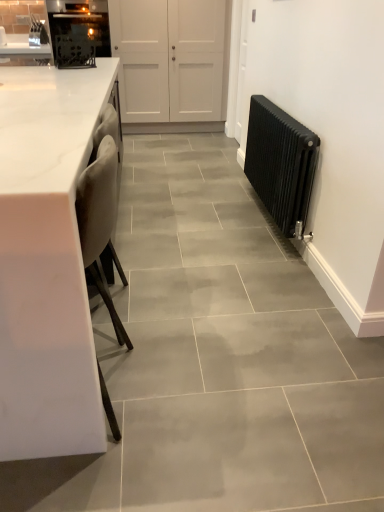
Question: Looking at their shapes, would you say white marble countertop at left is wider or thinner than white matte door at upper center?

Choices:
 (A) thin
 (B) wide

Answer: (B)

Question: Is white marble countertop at left bigger or smaller than white matte door at upper center?

Choices:
 (A) big
 (B) small

Answer: (A)

Question: Which is nearer to the white matte door at upper center?

Choices:
 (A) white marble countertop at left
 (B) black metal radiator at right
 (C) black matte oven at upper left

Answer: (C)

Question: Which of these objects is positioned closest to the white marble countertop at left?

Choices:
 (A) white matte door at upper center
 (B) black metal radiator at right
 (C) black matte oven at upper left

Answer: (B)